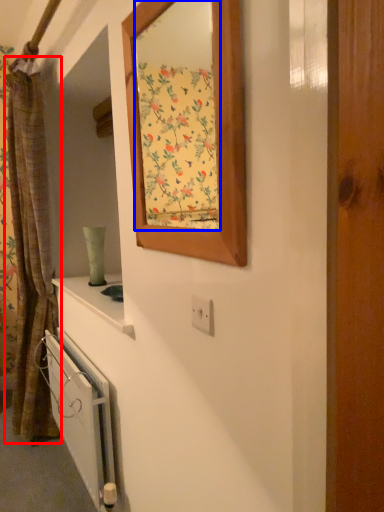
Question: Among these objects, which one is nearest to the camera, curtain (highlighted by a red box) or mirror (highlighted by a blue box)?

Choices:
 (A) curtain
 (B) mirror

Answer: (B)